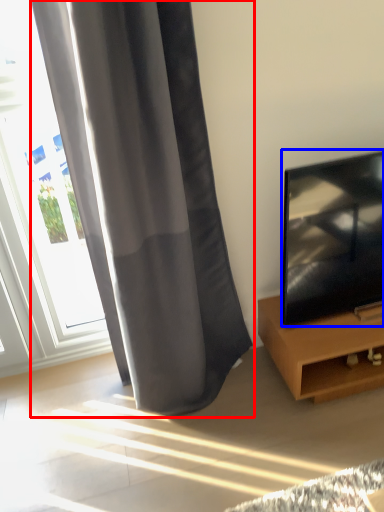
Question: Which object is further to the camera taking this photo, curtain (highlighted by a red box) or television (highlighted by a blue box)?

Choices:
 (A) curtain
 (B) television

Answer: (B)